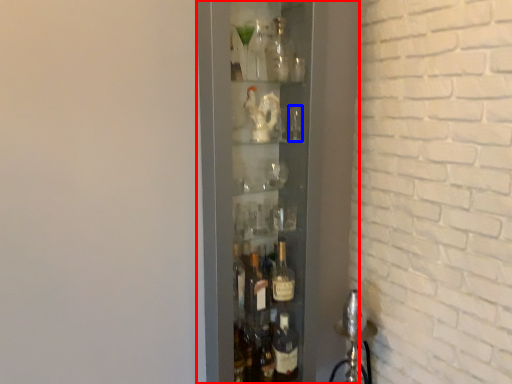
Question: Which object appears closest to the camera in this image, shelf (highlighted by a red box) or shot glass (highlighted by a blue box)?

Choices:
 (A) shelf
 (B) shot glass

Answer: (A)